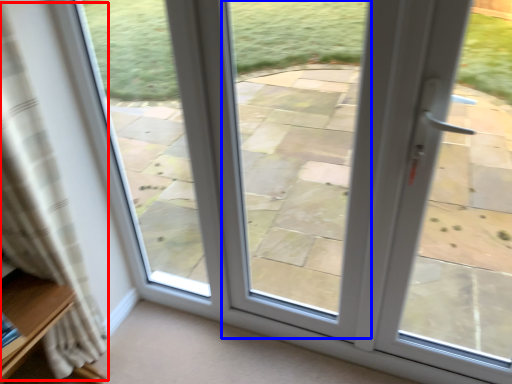
Question: Which object appears farthest to the camera in this image, curtain (highlighted by a red box) or window (highlighted by a blue box)?

Choices:
 (A) curtain
 (B) window

Answer: (B)